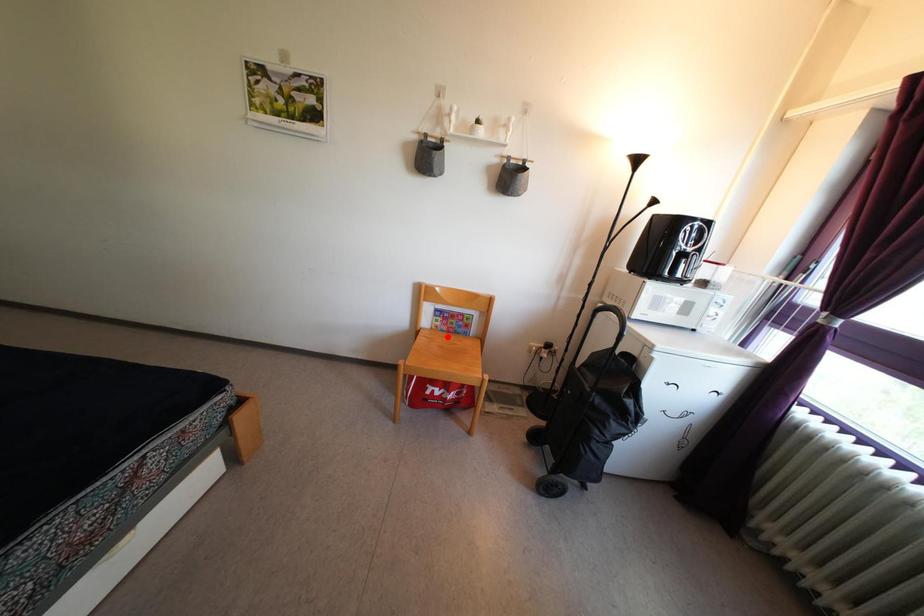
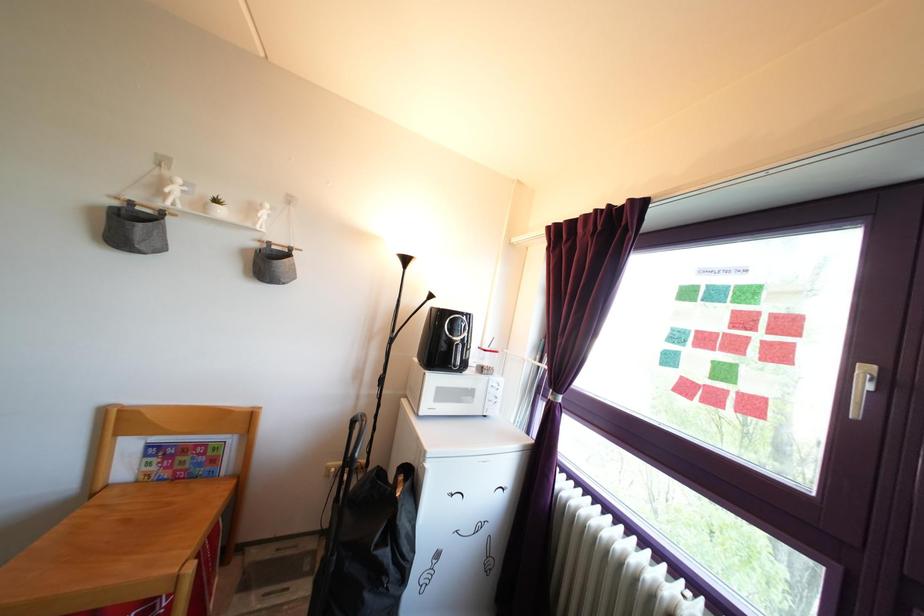
The point at the highlighted location is marked in the first image. Where is the corresponding point in the second image?

(169, 483)